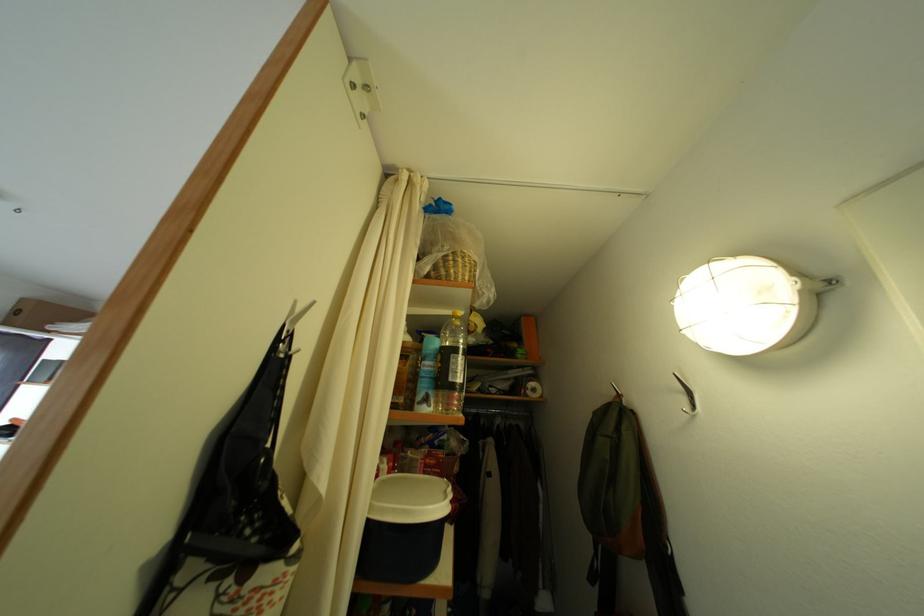
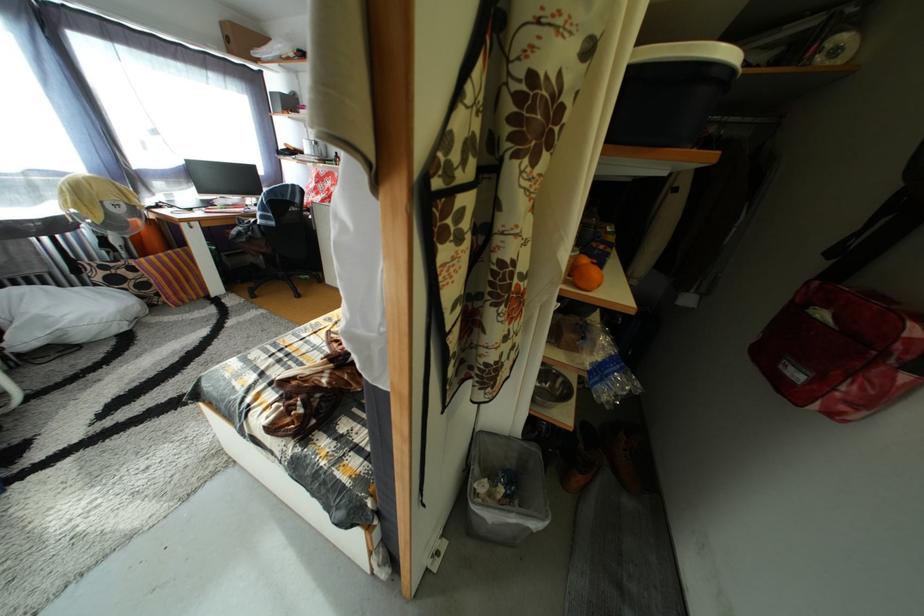
First-person continuous shooting, in which direction is the camera rotating?

The rotation direction of the camera is left-down.